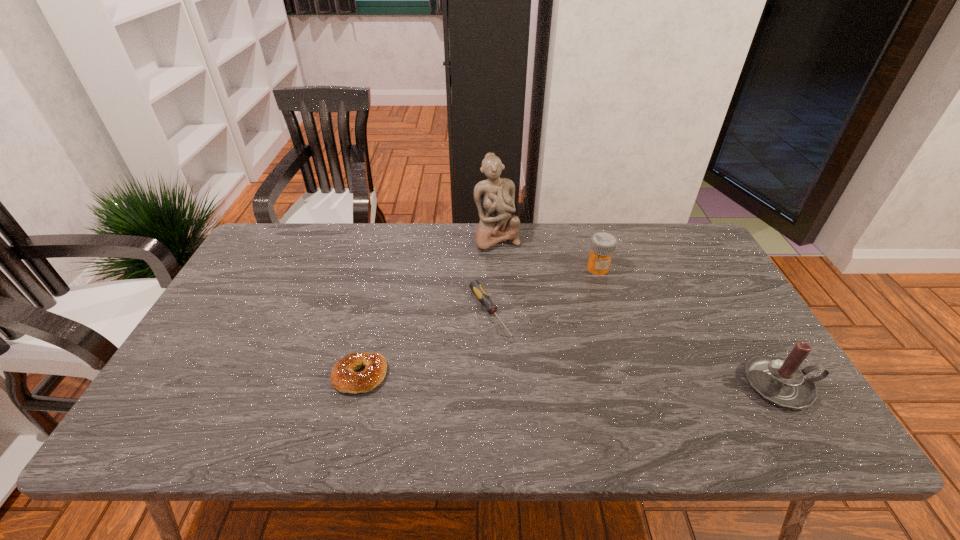
Locate an element on the screen. free space on the desktop that is between the bagel and the rightmost object and is positioned insert the third farthest object into a screw head is located at coordinates (539, 380).

What are the coordinates of `vacant space on the desktop that is between the bagel and the second tallest object and is positioned on the front-facing side of the farthest object` in the screenshot? It's located at (558, 380).

Find the location of a particular element. vacant space on the desktop that is between the fourth tallest object and the rightmost object and is positioned on the label side of the medicine is located at coordinates (545, 380).